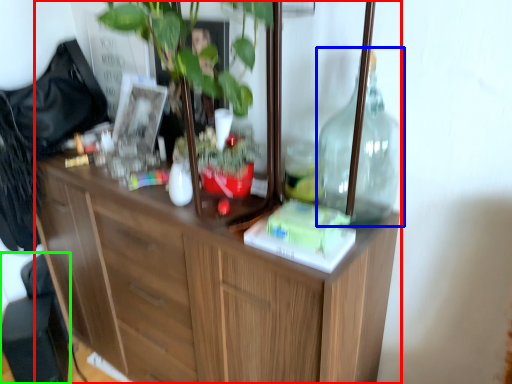
Question: Considering the real-world distances, which object is farthest from cabinetry (highlighted by a red box)? bottle (highlighted by a blue box) or swivel chair (highlighted by a green box)?

Choices:
 (A) bottle
 (B) swivel chair

Answer: (B)